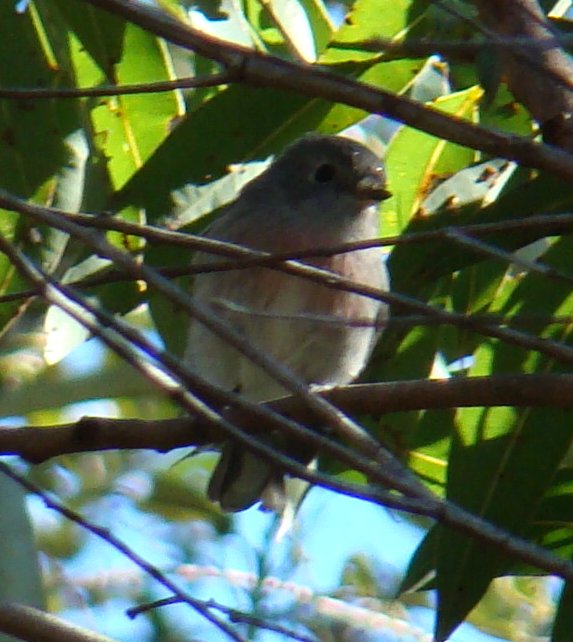
At what (x,y) coordinates should I click in order to perform the action: click on chest. Please return your answer as a coordinate pair (x, y). This screenshot has width=573, height=642. Looking at the image, I should click on (313, 291).